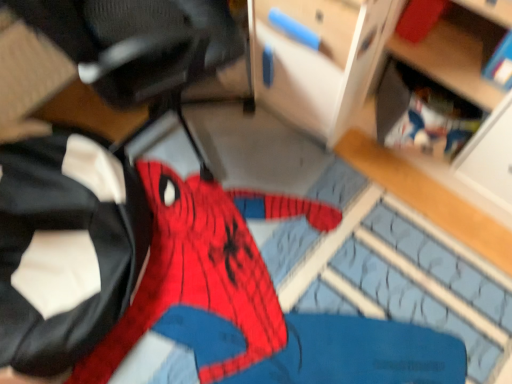
Question: Is point (488, 122) closer or farther from the camera than point (15, 193)?

Choices:
 (A) closer
 (B) farther

Answer: (A)

Question: From a real-world perspective, relative to red fabric spider-man costume at left, is wooden shelf at lower right, which ranks as the 1th shelf in front-to-back order, vertically above or below?

Choices:
 (A) below
 (B) above

Answer: (B)

Question: Which object is positioned closest to the wooden shelf at lower right, which is the second shelf from back to front?

Choices:
 (A) red fabric spider-man costume at left
 (B) wooden bookshelf at upper right, arranged as the first shelf when viewed from the back

Answer: (B)

Question: Which is farther from the wooden bookshelf at upper right, which is counted as the second shelf, starting from the front?

Choices:
 (A) wooden shelf at lower right, which ranks as the 1th shelf in front-to-back order
 (B) red fabric spider-man costume at left

Answer: (B)